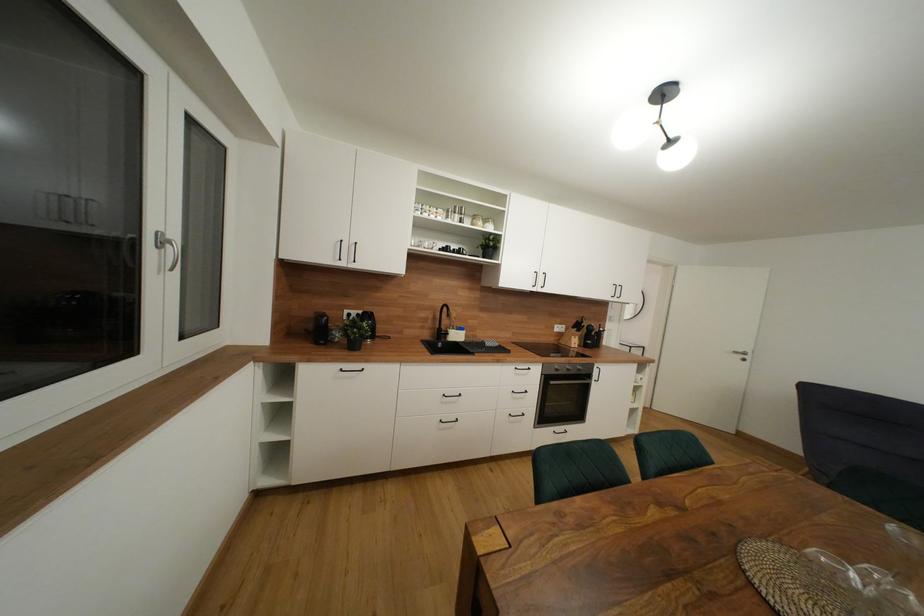
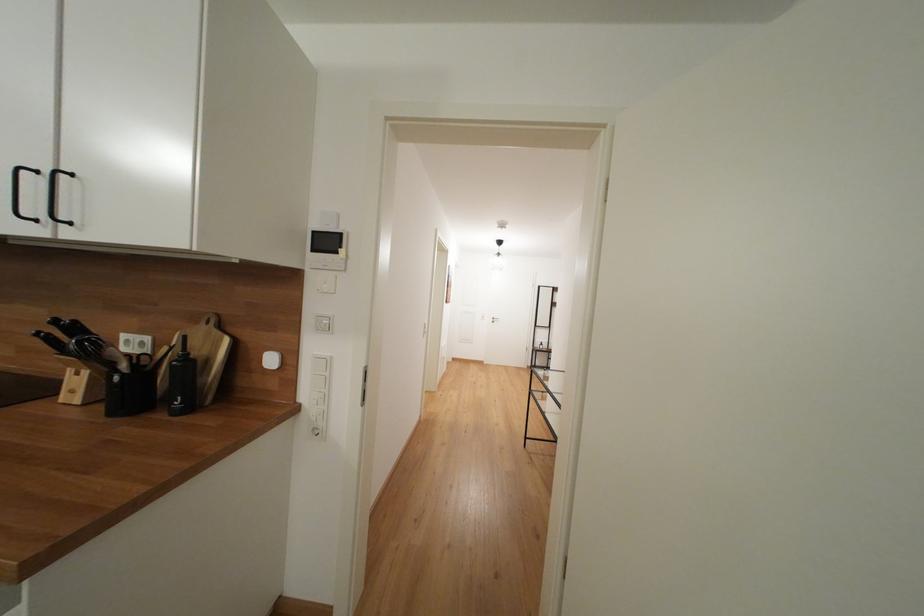
What movement of the cameraman would produce the second image?

The cameraman walked toward right, forward.